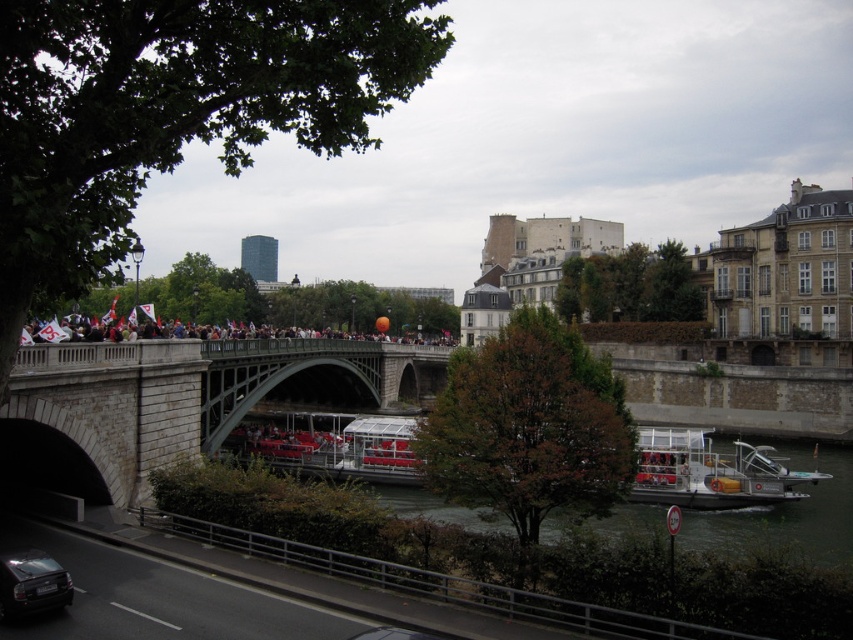
Question: Which object appears closest to the camera in this image?

Choices:
 (A) silver metallic boat at lower right
 (B) stone bridge at center
 (C) shiny black car at lower left

Answer: (C)

Question: Does stone bridge at center have a larger size compared to silver metallic boat at lower right?

Choices:
 (A) no
 (B) yes

Answer: (B)

Question: Which object appears closest to the camera in this image?

Choices:
 (A) silver metallic boat at lower right
 (B) stone bridge at center

Answer: (B)

Question: Does silver metallic boat at lower right have a smaller size compared to shiny black car at lower left?

Choices:
 (A) yes
 (B) no

Answer: (B)

Question: Based on their relative distances, which object is farther from the silver metallic boat at lower right?

Choices:
 (A) stone bridge at center
 (B) shiny black car at lower left

Answer: (B)

Question: Is stone bridge at center to the left of silver metallic boat at lower right from the viewer's perspective?

Choices:
 (A) yes
 (B) no

Answer: (A)